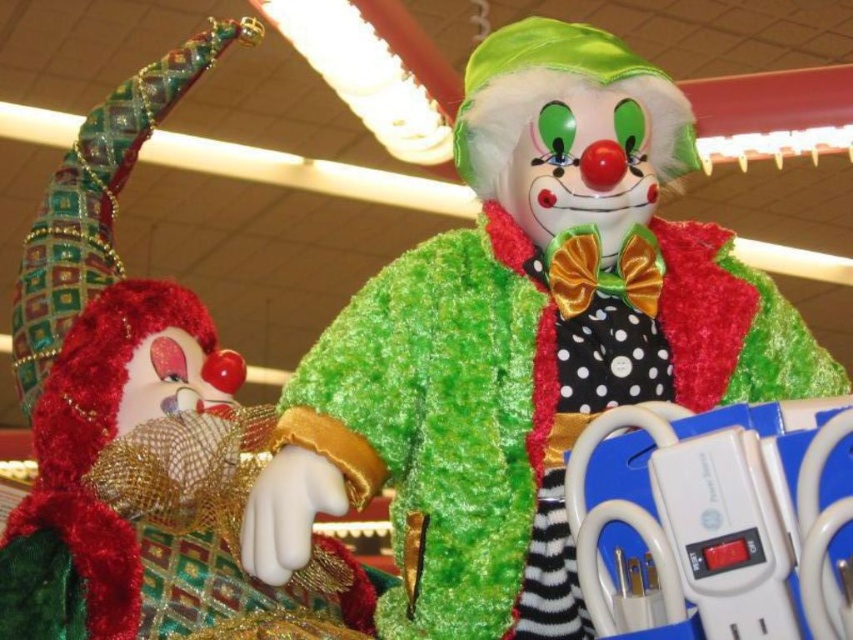
Identify the location of fuzzy green clown at center. Image resolution: width=853 pixels, height=640 pixels. (521, 342).

In order to click on fuzzy green clown at center in this screenshot , I will do `click(521, 342)`.